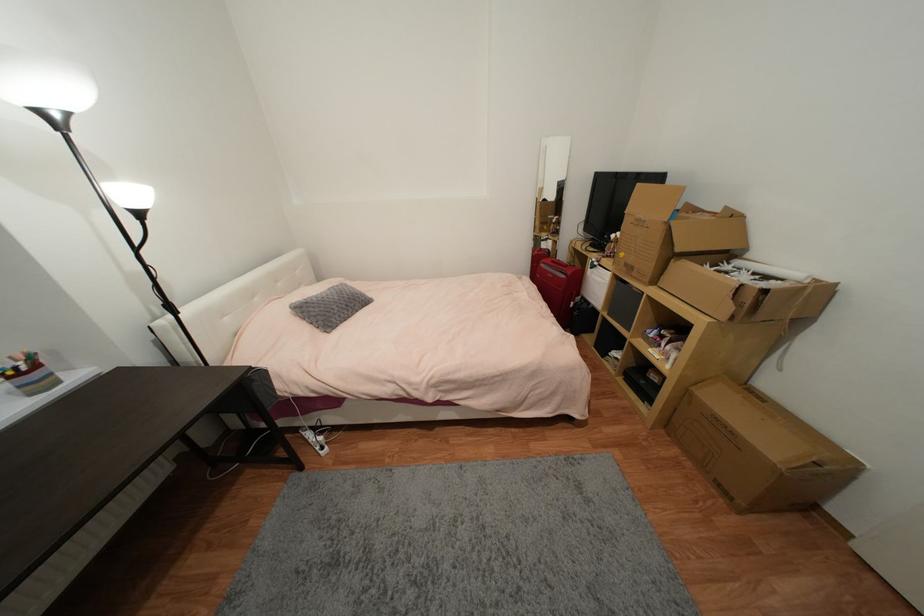
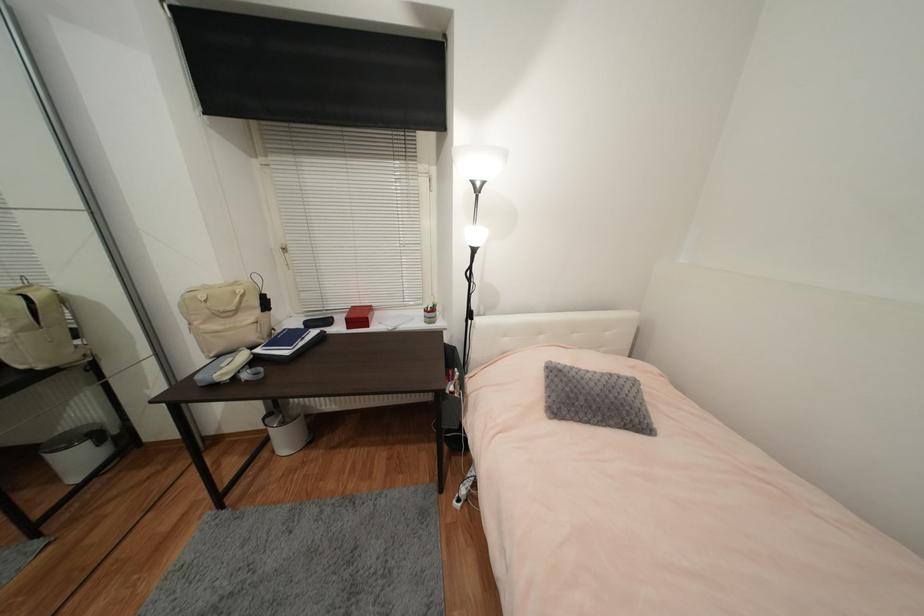
In the second image, find the point that corresponds to pixel 341 299 in the first image.

(602, 391)